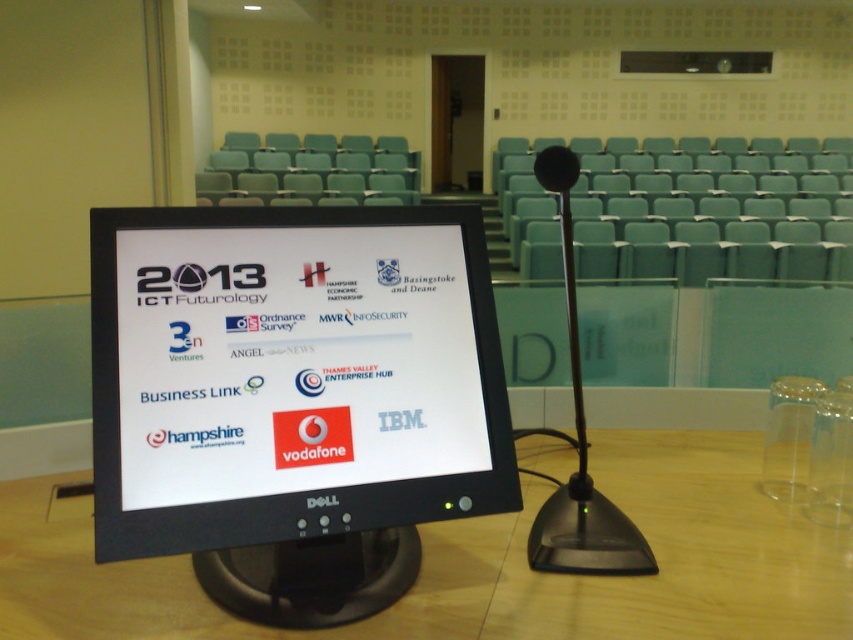
Who is shorter, black plastic monitor at center or wooden table at center?

With less height is wooden table at center.

Who is lower down, black plastic monitor at center or wooden table at center?

wooden table at center is lower down.

Between point (262, 214) and point (56, 589), which one is positioned behind?

Point (56, 589)

The width and height of the screenshot is (853, 640). Find the location of `black plastic monitor at center`. black plastic monitor at center is located at coordinates (293, 397).